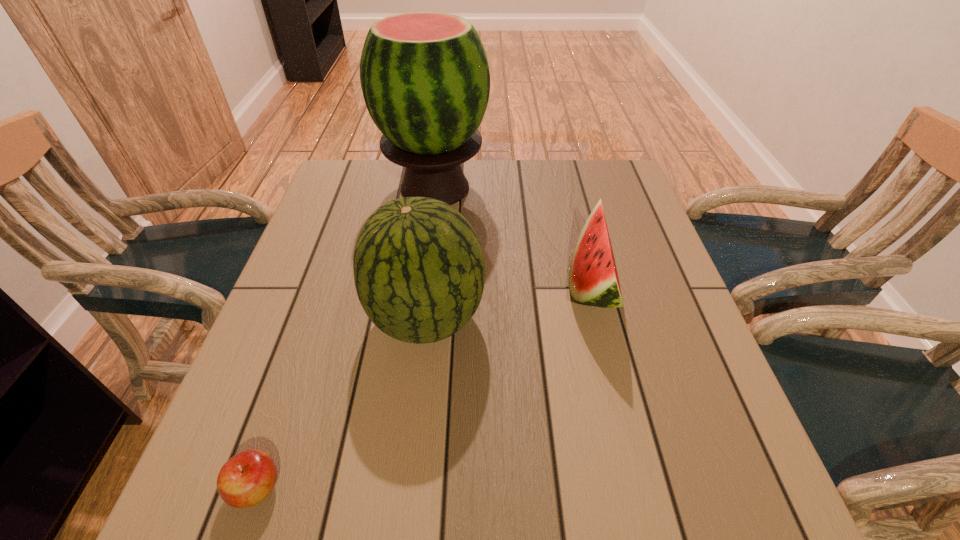
The image size is (960, 540). Identify the location of free space between the shortest watermelon and the third shortest object. (510, 302).

Find the location of `free spot between the third shortest object and the shortest object`. free spot between the third shortest object and the shortest object is located at coordinates (342, 403).

Find the location of `empty space that is in between the leftmost object and the farthest object`. empty space that is in between the leftmost object and the farthest object is located at coordinates (346, 338).

Where is `free spot between the rightmost object and the tallest object`? free spot between the rightmost object and the tallest object is located at coordinates (514, 237).

At what (x,y) coordinates should I click in order to perform the action: click on free space between the farthest watermelon and the nearest object. Please return your answer as a coordinate pair (x, y). This screenshot has width=960, height=540. Looking at the image, I should click on (346, 338).

I want to click on object that is the closest to the nearest object, so click(419, 270).

Select which object appears as the second closest to the second shortest object. Please provide its 2D coordinates. Your answer should be formatted as a tuple, i.e. [(x, y)], where the tuple contains the x and y coordinates of a point satisfying the conditions above.

[(425, 79)]

Choose which watermelon is the nearest neighbor to the farthest object. Please provide its 2D coordinates. Your answer should be formatted as a tuple, i.e. [(x, y)], where the tuple contains the x and y coordinates of a point satisfying the conditions above.

[(593, 279)]

Locate which watermelon ranks in proximity to the rightmost watermelon. Please provide its 2D coordinates. Your answer should be formatted as a tuple, i.e. [(x, y)], where the tuple contains the x and y coordinates of a point satisfying the conditions above.

[(419, 270)]

The image size is (960, 540). I want to click on free space in the image that satisfies the following two spatial constraints: 1. on the front side of the third shortest object; 2. on the right side of the farthest object, so click(x=418, y=319).